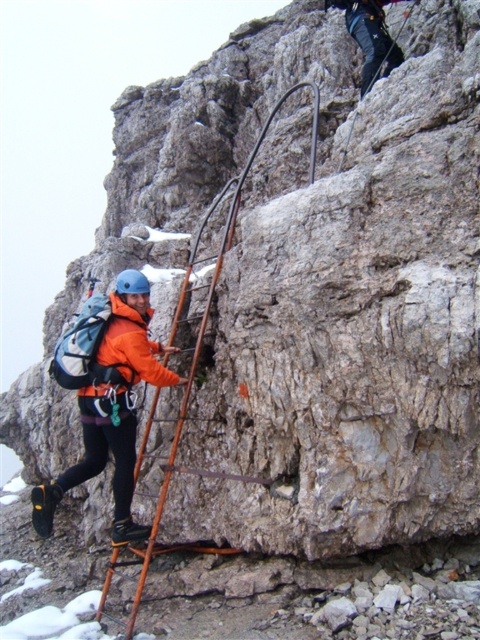
Is orange fabric jacket at left thinner than orange metal ladder at center?

Yes.

What do you see at coordinates (112, 406) in the screenshot?
I see `orange fabric jacket at left` at bounding box center [112, 406].

Who is more distant from viewer, (49, 531) or (199, 333)?

Point (199, 333)

Identify the location of orange fabric jacket at left. This screenshot has height=640, width=480. (112, 406).